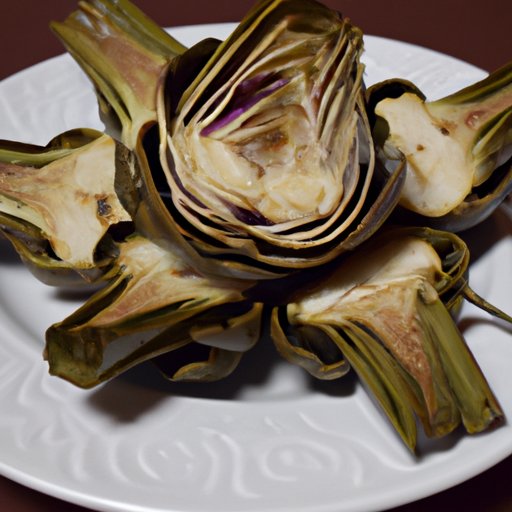
Where is `plate`? The image size is (512, 512). plate is located at coordinates (19, 352).